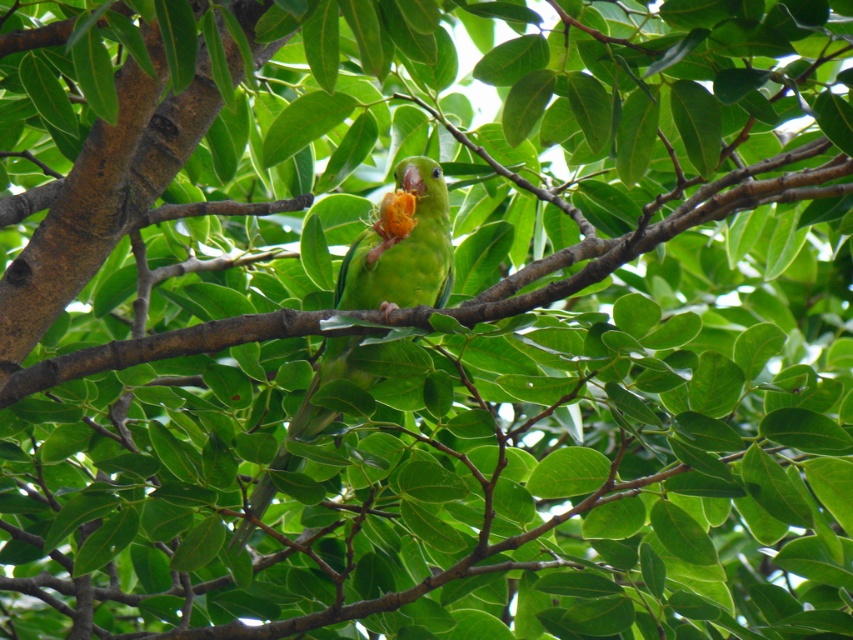
You are a birdwatcher trying to estimate the space between the brown rough tree branch at center and the green matte parrot at center. Based on the scene, can you determine if the space is more than 6 inches?

The distance between the brown rough tree branch at center and the green matte parrot at center is 6.99 inches, which is just over 6 inches. Therefore, the space is more than 6 inches.

You are a birdwatcher observing the scene. You notice the brown rough tree branch at center and the green matte parrot at center. Which object is positioned higher in the image?

The brown rough tree branch at center is located above the green matte parrot at center, so it is positioned higher in the image.

You are a birdwatcher observing the scene. You notice the brown rough tree branch at center and the green matte parrot at center. Which object is shorter in height?

The brown rough tree branch at center is shorter in height compared to the green matte parrot at center according to the description.